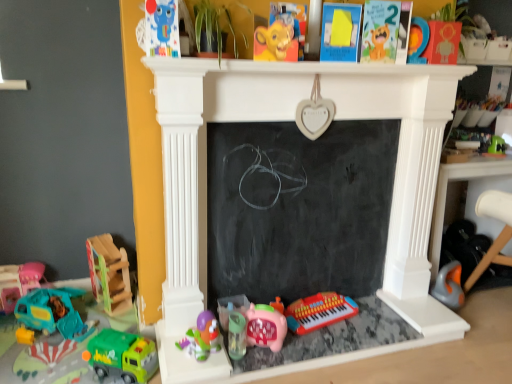
Question: Are matte orange wooden number at upper right, the 2th toy viewed from the right, and teal plastic toy car at left, arranged as the 12th toy when viewed from the right, located far from each other?

Choices:
 (A) yes
 (B) no

Answer: (A)

Question: Is matte orange wooden number at upper right, the 2th toy viewed from the right, completely or partially outside of teal plastic toy car at left, placed as the 1th toy when sorted from left to right?

Choices:
 (A) yes
 (B) no

Answer: (A)

Question: From a real-world perspective, is matte orange wooden number at upper right, the 2th toy viewed from the right, on teal plastic toy car at left, arranged as the 12th toy when viewed from the right?

Choices:
 (A) yes
 (B) no

Answer: (A)

Question: Is the depth of matte orange wooden number at upper right, marked as the eleventh toy in a left-to-right arrangement, greater than that of teal plastic toy car at left, placed as the 1th toy when sorted from left to right?

Choices:
 (A) no
 (B) yes

Answer: (A)

Question: Does matte orange wooden number at upper right, marked as the eleventh toy in a left-to-right arrangement, have a lesser width compared to teal plastic toy car at left, placed as the 1th toy when sorted from left to right?

Choices:
 (A) no
 (B) yes

Answer: (B)

Question: From the image's perspective, does matte orange wooden number at upper right, the 2th toy viewed from the right, appear higher than teal plastic toy car at left, placed as the 1th toy when sorted from left to right?

Choices:
 (A) yes
 (B) no

Answer: (A)

Question: Considering the relative positions of orange plastic vacuum cleaner at lower right, the 1th toy viewed from the right, and wooden rocking horse at left, the tenth toy in the right-to-left sequence, in the image provided, is orange plastic vacuum cleaner at lower right, the 1th toy viewed from the right, to the right of wooden rocking horse at left, the tenth toy in the right-to-left sequence, from the viewer's perspective?

Choices:
 (A) no
 (B) yes

Answer: (B)

Question: Does orange plastic vacuum cleaner at lower right, the twelfth toy when ordered from left to right, contain wooden rocking horse at left, the third toy from the left?

Choices:
 (A) no
 (B) yes

Answer: (A)

Question: Is orange plastic vacuum cleaner at lower right, the twelfth toy when ordered from left to right, further to the viewer compared to wooden rocking horse at left, the tenth toy in the right-to-left sequence?

Choices:
 (A) no
 (B) yes

Answer: (B)

Question: From a real-world perspective, is orange plastic vacuum cleaner at lower right, the twelfth toy when ordered from left to right, physically above wooden rocking horse at left, the tenth toy in the right-to-left sequence?

Choices:
 (A) no
 (B) yes

Answer: (A)

Question: From a real-world perspective, is orange plastic vacuum cleaner at lower right, the twelfth toy when ordered from left to right, positioned under wooden rocking horse at left, the tenth toy in the right-to-left sequence, based on gravity?

Choices:
 (A) yes
 (B) no

Answer: (A)

Question: Are orange plastic vacuum cleaner at lower right, the 1th toy viewed from the right, and wooden rocking horse at left, the tenth toy in the right-to-left sequence, located far from each other?

Choices:
 (A) yes
 (B) no

Answer: (A)

Question: Is pink matte piggy bank at center, the eighth toy in the left-to-right sequence, shorter than translucent plastic sippy cup at lower center, which is the seventh toy from left to right?

Choices:
 (A) no
 (B) yes

Answer: (A)